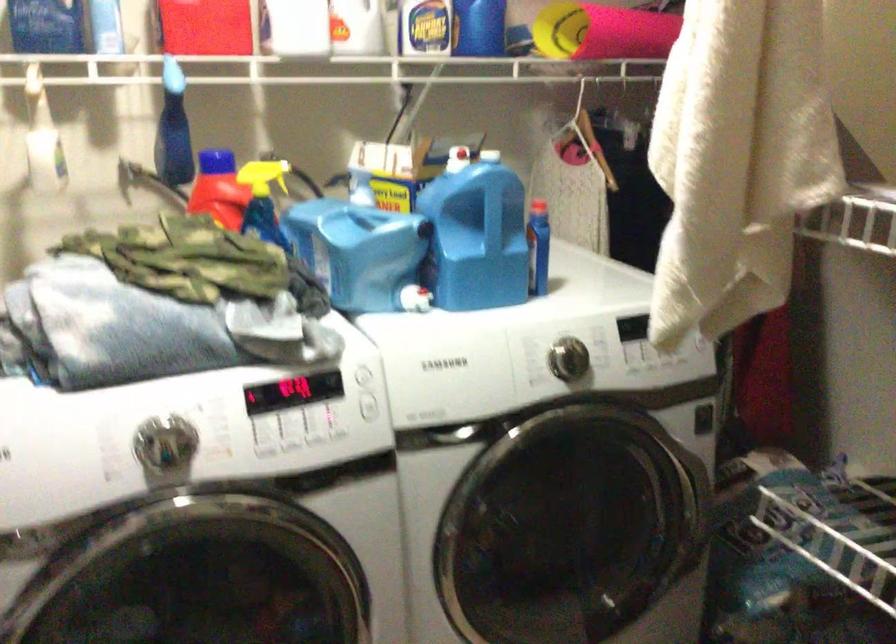
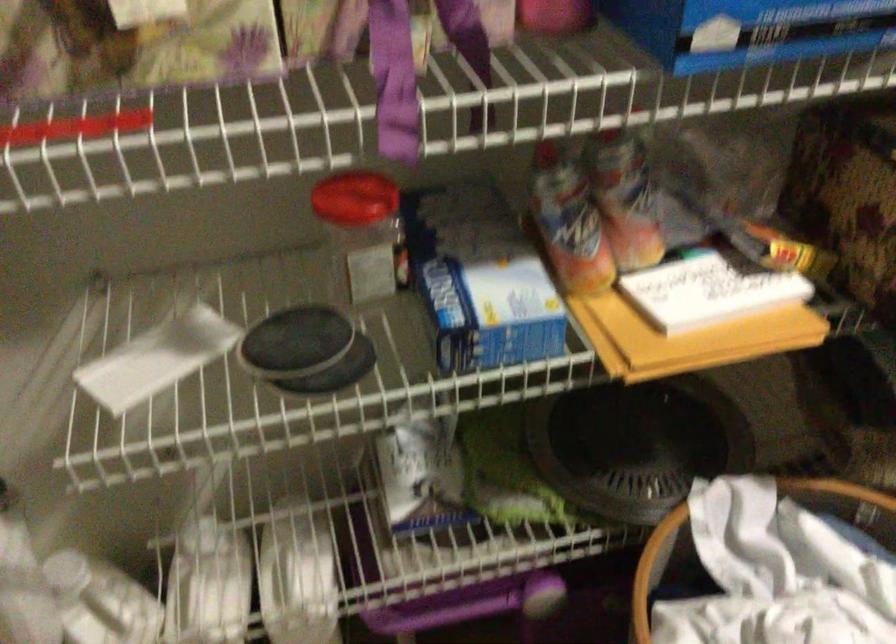
Based on the continuous images, in which direction is the camera rotating?

The rotation direction of the camera is left-down.